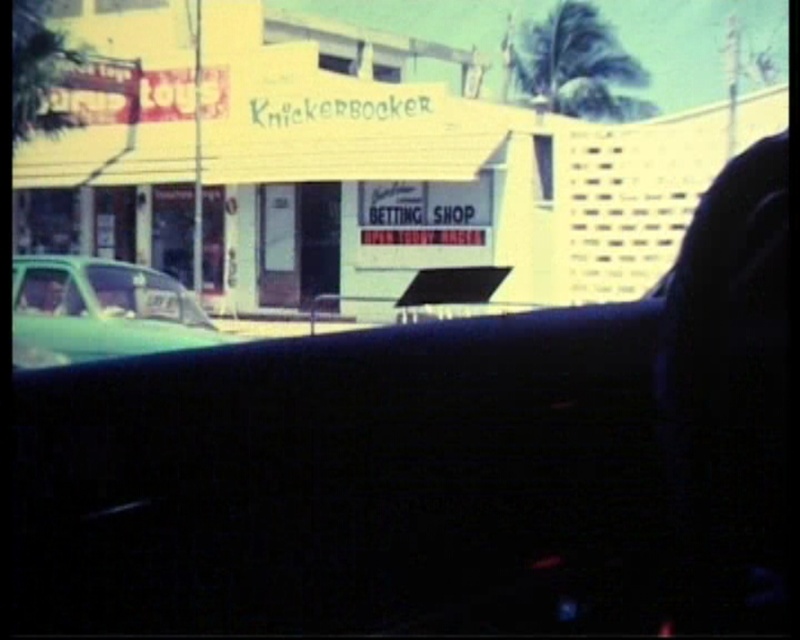
You are a passenger in the teal glossy car at left and want to exit through the door closest to the green matte windshield at lower left. Is the door on your left or right side?

The teal glossy car at left is positioned on the left side of the green matte windshield at lower left, so the door closest to the green matte windshield at lower left is on your right side.

You are a passenger in the car and want to read the smaller sign below the main sign. Which object, the green matte windshield at lower left or the clear glass window at left, would you look through to get a better view of the smaller sign?

You should look through the clear glass window at left because the green matte windshield at lower left is located above it, meaning the clear glass window at left is lower and closer to the smaller sign.

You are sitting in the driver seat of the car and looking through the windshield. There are two points marked on the windshield. One is at coordinate point (156, 305) and the other is at point (30, 269). Which point is closer to you?

Point (156, 305) is closer to you because it is further to the viewer than point (30, 269).